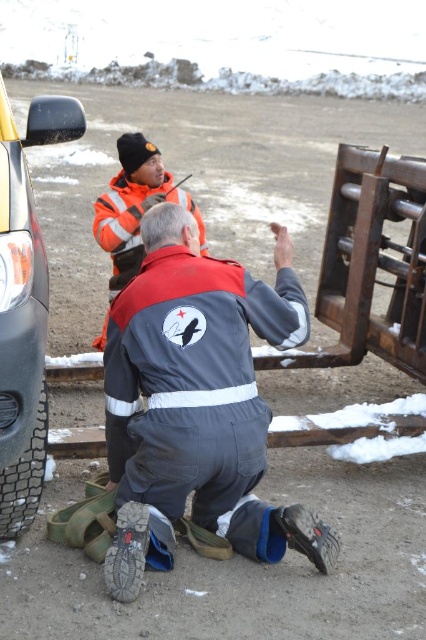
Question: In this image, where is black rubber tire at left located relative to black rubber tire at lower left?

Choices:
 (A) above
 (B) below

Answer: (A)

Question: Can you confirm if gray fabric jumpsuit at center is smaller than black rubber tire at lower left?

Choices:
 (A) yes
 (B) no

Answer: (B)

Question: Which point is closer to the camera?

Choices:
 (A) black rubber tire at left
 (B) black rubber tire at lower left

Answer: (A)

Question: Is gray fabric jumpsuit at center smaller than black rubber tire at left?

Choices:
 (A) yes
 (B) no

Answer: (B)

Question: Based on their relative distances, which object is farther from the black rubber tire at left?

Choices:
 (A) black rubber tire at lower left
 (B) gray fabric jumpsuit at center

Answer: (B)

Question: Which point is farther from the camera taking this photo?

Choices:
 (A) (49, 138)
 (B) (16, 488)
 (C) (149, 289)

Answer: (A)